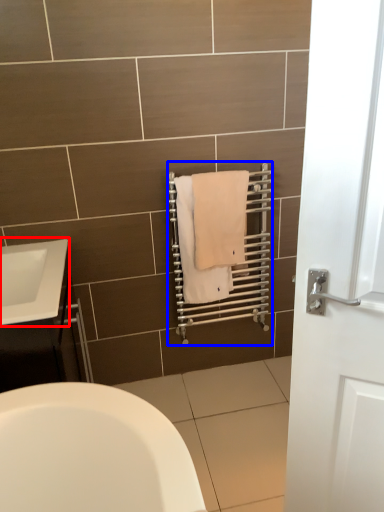
Question: Which of the following is the farthest to the observer, sink (highlighted by a red box) or balustrade (highlighted by a blue box)?

Choices:
 (A) sink
 (B) balustrade

Answer: (B)